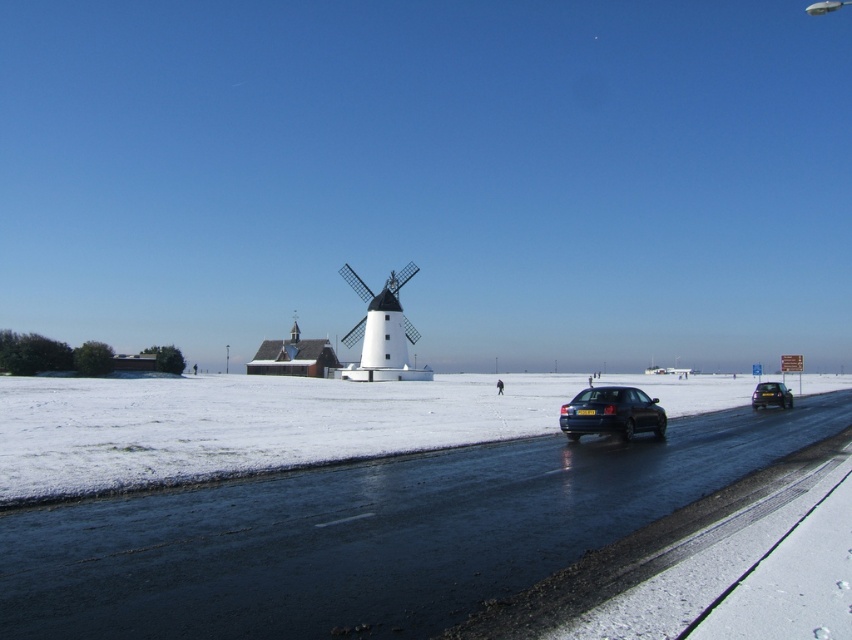
Question: Is white matte windmill at center bigger than shiny black sedan at right?

Choices:
 (A) no
 (B) yes

Answer: (B)

Question: Does white matte windmill at center appear on the left side of shiny black sedan at right?

Choices:
 (A) no
 (B) yes

Answer: (B)

Question: Which object is the farthest from the shiny black sedan at right?

Choices:
 (A) white powdery snow at road center
 (B) glossy dark blue car at center

Answer: (A)

Question: Is white powdery snow at road center positioned behind white matte windmill at center?

Choices:
 (A) yes
 (B) no

Answer: (B)

Question: Among these points, which one is farthest from the camera?

Choices:
 (A) (384, 336)
 (B) (674, 387)
 (C) (767, 387)
 (D) (565, 419)

Answer: (B)

Question: Which object appears closest to the camera in this image?

Choices:
 (A) white matte windmill at center
 (B) white powdery snow at road center

Answer: (B)